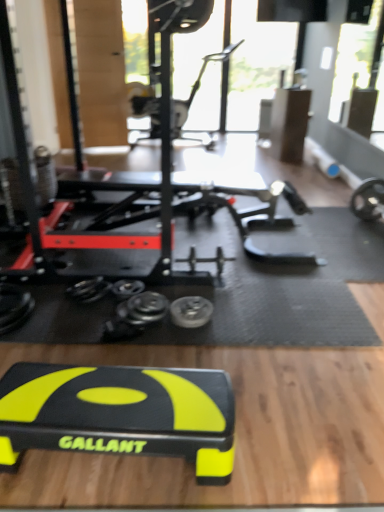
Where is `metallic silver weight at center`? The image size is (384, 512). metallic silver weight at center is located at coordinates (191, 311).

Identify the location of metallic silver exercise bike at upper center, which is counted as the 2th sport equipment, starting from the front. (195, 91).

How much space does metallic silver exercise bike at upper center, marked as the 1th sport equipment in a top-to-bottom arrangement, occupy vertically?

It is 1.22 meters.

The image size is (384, 512). Identify the location of black rubber step platform at center, arranged as the 2th sport equipment when viewed from the top. pos(119,413).

From a real-world perspective, is black rubber step platform at center, which is the second sport equipment in back-to-front order, under metallic silver weight at center?

No.

Is black rubber step platform at center, which is the second sport equipment in back-to-front order, taller than metallic silver weight at center?

Indeed, black rubber step platform at center, which is the second sport equipment in back-to-front order, has a greater height compared to metallic silver weight at center.

Looking at the image, does black rubber step platform at center, the first sport equipment from the bottom, seem bigger or smaller compared to metallic silver weight at center?

Clearly, black rubber step platform at center, the first sport equipment from the bottom, is larger in size than metallic silver weight at center.

Does black rubber step platform at center, which is the second sport equipment in back-to-front order, have a larger size compared to metallic silver exercise bike at upper center, marked as the 1th sport equipment in a top-to-bottom arrangement?

Incorrect, black rubber step platform at center, which is the second sport equipment in back-to-front order, is not larger than metallic silver exercise bike at upper center, marked as the 1th sport equipment in a top-to-bottom arrangement.

Is black rubber step platform at center, arranged as the first sport equipment when viewed from the front, taller than metallic silver exercise bike at upper center, marked as the 1th sport equipment in a top-to-bottom arrangement?

No.

From the image's perspective, would you say black rubber step platform at center, which is the second sport equipment in back-to-front order, is shown under metallic silver exercise bike at upper center, the 1th sport equipment positioned from the back?

Yes.

Where is `the 1st sport equipment directly above the metallic silver weight at center (from a real-world perspective)`? This screenshot has height=512, width=384. the 1st sport equipment directly above the metallic silver weight at center (from a real-world perspective) is located at coordinates point(119,413).

Is metallic silver weight at center to the left of black rubber step platform at center, arranged as the 2th sport equipment when viewed from the top, from the viewer's perspective?

No.

Is metallic silver weight at center oriented away from black rubber step platform at center, arranged as the first sport equipment when viewed from the front?

No, black rubber step platform at center, arranged as the first sport equipment when viewed from the front, is not at the back of metallic silver weight at center.

Is point (176, 303) closer or farther from the camera than point (13, 376)?

Point (176, 303).

Measure the distance from metallic silver exercise bike at upper center, which is counted as the 2th sport equipment, starting from the front, to metallic silver weight at center.

12.46 feet.

Which object is closer to the camera taking this photo, metallic silver exercise bike at upper center, which is the 2th sport equipment in bottom-to-top order, or metallic silver weight at center?

metallic silver weight at center is in front.

Does metallic silver exercise bike at upper center, which is counted as the 2th sport equipment, starting from the front, turn towards metallic silver weight at center?

Yes, metallic silver exercise bike at upper center, which is counted as the 2th sport equipment, starting from the front, is aimed at metallic silver weight at center.

From a real-world perspective, is metallic silver exercise bike at upper center, marked as the 1th sport equipment in a top-to-bottom arrangement, positioned over metallic silver weight at center based on gravity?

Yes.

Is metallic silver exercise bike at upper center, which is the 2th sport equipment in bottom-to-top order, with black rubber step platform at center, arranged as the first sport equipment when viewed from the front?

There is a gap between metallic silver exercise bike at upper center, which is the 2th sport equipment in bottom-to-top order, and black rubber step platform at center, arranged as the first sport equipment when viewed from the front.

Considering the sizes of objects metallic silver exercise bike at upper center, which is counted as the 2th sport equipment, starting from the front, and black rubber step platform at center, the first sport equipment from the bottom, in the image provided, who is wider, metallic silver exercise bike at upper center, which is counted as the 2th sport equipment, starting from the front, or black rubber step platform at center, the first sport equipment from the bottom,?

With larger width is black rubber step platform at center, the first sport equipment from the bottom.

Is metallic silver exercise bike at upper center, which is the 2th sport equipment in bottom-to-top order, oriented away from black rubber step platform at center, the first sport equipment from the bottom?

No, metallic silver exercise bike at upper center, which is the 2th sport equipment in bottom-to-top order,'s orientation is not away from black rubber step platform at center, the first sport equipment from the bottom.

How distant is metallic silver exercise bike at upper center, the 1th sport equipment positioned from the back, from black rubber step platform at center, arranged as the 2th sport equipment when viewed from the top?

metallic silver exercise bike at upper center, the 1th sport equipment positioned from the back, and black rubber step platform at center, arranged as the 2th sport equipment when viewed from the top, are 14.39 feet apart from each other.

Is the depth of metallic silver weight at center greater than that of metallic silver exercise bike at upper center, which is counted as the 2th sport equipment, starting from the front?

No, the depth of metallic silver weight at center is less than that of metallic silver exercise bike at upper center, which is counted as the 2th sport equipment, starting from the front.

Between metallic silver weight at center and metallic silver exercise bike at upper center, the 1th sport equipment positioned from the back, which one has smaller size?

Smaller between the two is metallic silver weight at center.

Based on their positions, is metallic silver weight at center located to the left or right of metallic silver exercise bike at upper center, which is the 2th sport equipment in bottom-to-top order?

From the image, it's evident that metallic silver weight at center is to the left of metallic silver exercise bike at upper center, which is the 2th sport equipment in bottom-to-top order.

In the scene shown: From the image's perspective, is metallic silver weight at center positioned above or below metallic silver exercise bike at upper center, which is the 2th sport equipment in bottom-to-top order?

From the image's perspective, metallic silver weight at center appears below metallic silver exercise bike at upper center, which is the 2th sport equipment in bottom-to-top order.

Where is `tire that appears below the black rubber step platform at center, the first sport equipment from the bottom (from a real-world perspective)`? This screenshot has width=384, height=512. tire that appears below the black rubber step platform at center, the first sport equipment from the bottom (from a real-world perspective) is located at coordinates (191, 311).

The image size is (384, 512). Find the location of `sport equipment located below the metallic silver exercise bike at upper center, marked as the 1th sport equipment in a top-to-bottom arrangement (from the image's perspective)`. sport equipment located below the metallic silver exercise bike at upper center, marked as the 1th sport equipment in a top-to-bottom arrangement (from the image's perspective) is located at coordinates (119, 413).

From the image, which object appears to be farther from metallic silver exercise bike at upper center, which is the 2th sport equipment in bottom-to-top order, metallic silver weight at center or black rubber step platform at center, arranged as the 2th sport equipment when viewed from the top?

The object further to metallic silver exercise bike at upper center, which is the 2th sport equipment in bottom-to-top order, is black rubber step platform at center, arranged as the 2th sport equipment when viewed from the top.

When comparing their distances from metallic silver weight at center, does metallic silver exercise bike at upper center, the 1th sport equipment positioned from the back, or black rubber step platform at center, arranged as the 2th sport equipment when viewed from the top, seem further?

metallic silver exercise bike at upper center, the 1th sport equipment positioned from the back, is further to metallic silver weight at center.

Based on their spatial positions, is metallic silver weight at center or metallic silver exercise bike at upper center, which is the 2th sport equipment in bottom-to-top order, closer to black rubber step platform at center, arranged as the 2th sport equipment when viewed from the top?

metallic silver weight at center lies closer to black rubber step platform at center, arranged as the 2th sport equipment when viewed from the top, than the other object.

Looking at the image, which one is located closer to black rubber step platform at center, arranged as the 2th sport equipment when viewed from the top, metallic silver exercise bike at upper center, marked as the 1th sport equipment in a top-to-bottom arrangement, or metallic silver weight at center?

Based on the image, metallic silver weight at center appears to be nearer to black rubber step platform at center, arranged as the 2th sport equipment when viewed from the top.

Estimate the real-world distances between objects in this image. Which object is further from metallic silver weight at center, black rubber step platform at center, arranged as the 2th sport equipment when viewed from the top, or metallic silver exercise bike at upper center, the 1th sport equipment positioned from the back?

metallic silver exercise bike at upper center, the 1th sport equipment positioned from the back, is positioned further to the anchor metallic silver weight at center.

Estimate the real-world distances between objects in this image. Which object is closer to metallic silver exercise bike at upper center, which is counted as the 2th sport equipment, starting from the front, black rubber step platform at center, which is the second sport equipment in back-to-front order, or metallic silver weight at center?

Based on the image, metallic silver weight at center appears to be nearer to metallic silver exercise bike at upper center, which is counted as the 2th sport equipment, starting from the front.

Where is `tire between black rubber step platform at center, arranged as the 2th sport equipment when viewed from the top, and metallic silver exercise bike at upper center, marked as the 1th sport equipment in a top-to-bottom arrangement, along the z-axis`? tire between black rubber step platform at center, arranged as the 2th sport equipment when viewed from the top, and metallic silver exercise bike at upper center, marked as the 1th sport equipment in a top-to-bottom arrangement, along the z-axis is located at coordinates (191, 311).